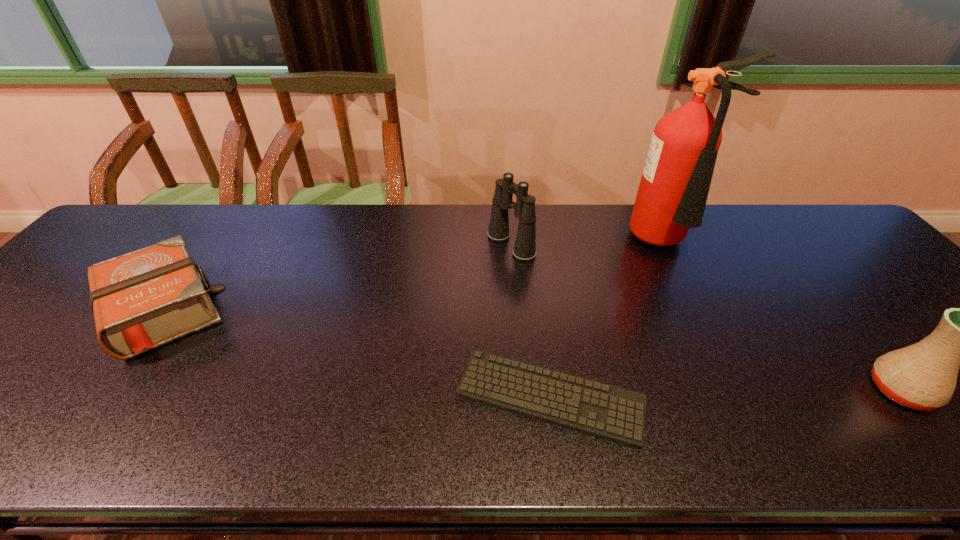
I want to click on free space that is in between the Bible and the fire extinguisher, so click(x=416, y=277).

Image resolution: width=960 pixels, height=540 pixels. In order to click on vacant area that lies between the pottery and the tallest object in this screenshot , I will do `click(784, 317)`.

At what (x,y) coordinates should I click in order to perform the action: click on free area in between the tallest object and the binoculars. Please return your answer as a coordinate pair (x, y). The image size is (960, 540). Looking at the image, I should click on (589, 245).

Find the location of a particular element. The width and height of the screenshot is (960, 540). unoccupied area between the leftmost object and the pottery is located at coordinates (532, 350).

The height and width of the screenshot is (540, 960). Find the location of `free space between the tallest object and the Bible`. free space between the tallest object and the Bible is located at coordinates (416, 277).

This screenshot has height=540, width=960. I want to click on vacant area between the computer keyboard and the fourth tallest object, so click(x=357, y=354).

At what (x,y) coordinates should I click in order to perform the action: click on vacant point located between the pottery and the computer keyboard. Please return your answer as a coordinate pair (x, y). This screenshot has height=540, width=960. Looking at the image, I should click on (726, 394).

Locate an element on the screen. vacant area between the binoculars and the shortest object is located at coordinates (531, 321).

You are a GUI agent. You are given a task and a screenshot of the screen. Output one action in this format:
    pyautogui.click(x=<x>, y=<y>)
    Task: Click on the free space between the rightmost object and the shortest object
    This screenshot has height=540, width=960.
    Given the screenshot: What is the action you would take?
    pyautogui.click(x=726, y=394)

The height and width of the screenshot is (540, 960). In order to click on vacant area that lies between the binoculars and the computer keyboard in this screenshot , I will do `click(531, 321)`.